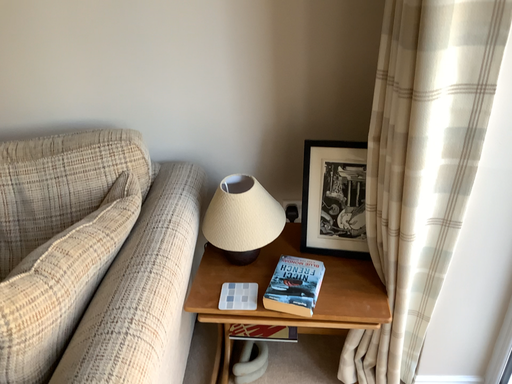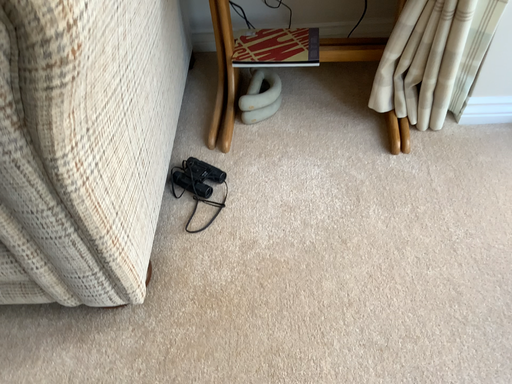
Question: Which way did the camera rotate in the video?

Choices:
 (A) rotated downward
 (B) rotated upward

Answer: (A)